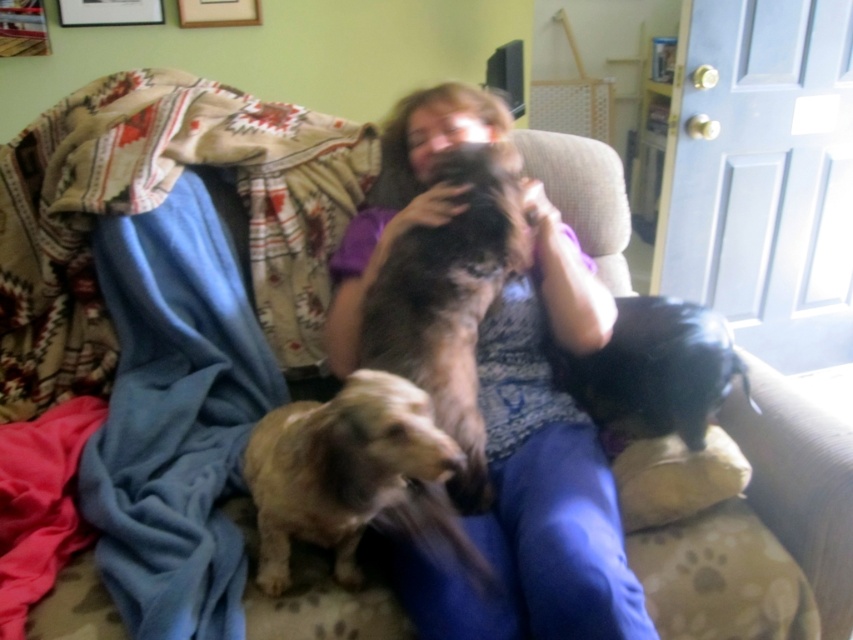
You are a photographer setting up for a family photo. You need to ensure both the brown fur dog at center and the black leather dog at lower right are fully visible in the frame. Based on their positions and sizes, which dog might require more space in the composition?

The brown fur dog at center might require more space in the composition since it is wider than the black leather dog at lower right according to the description.

You are taking a photo of the two points in the scene. Which point, point (357, 390) or point (621, 321), will appear larger in your photo?

Point (357, 390) will appear larger in the photo because it is closer to the camera than point (621, 321).